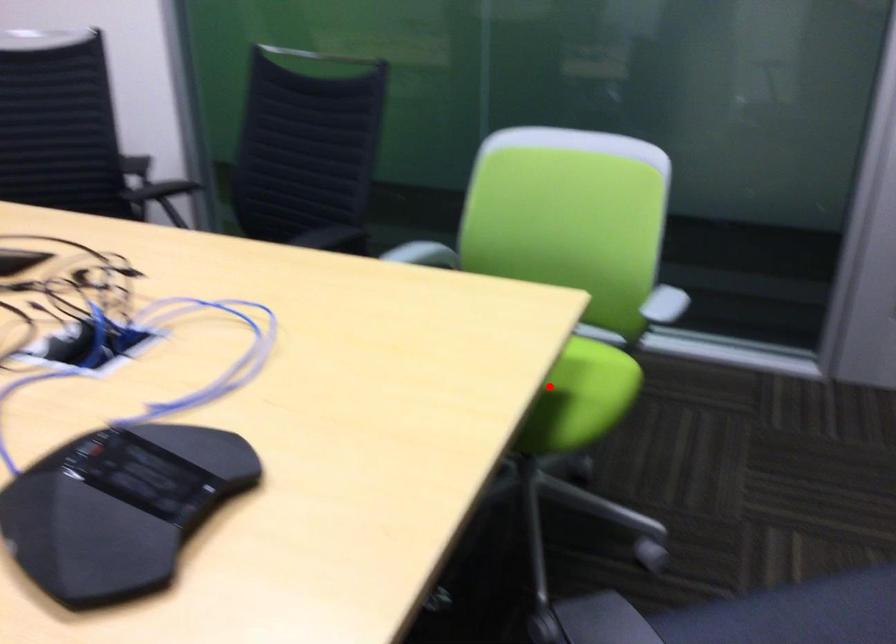
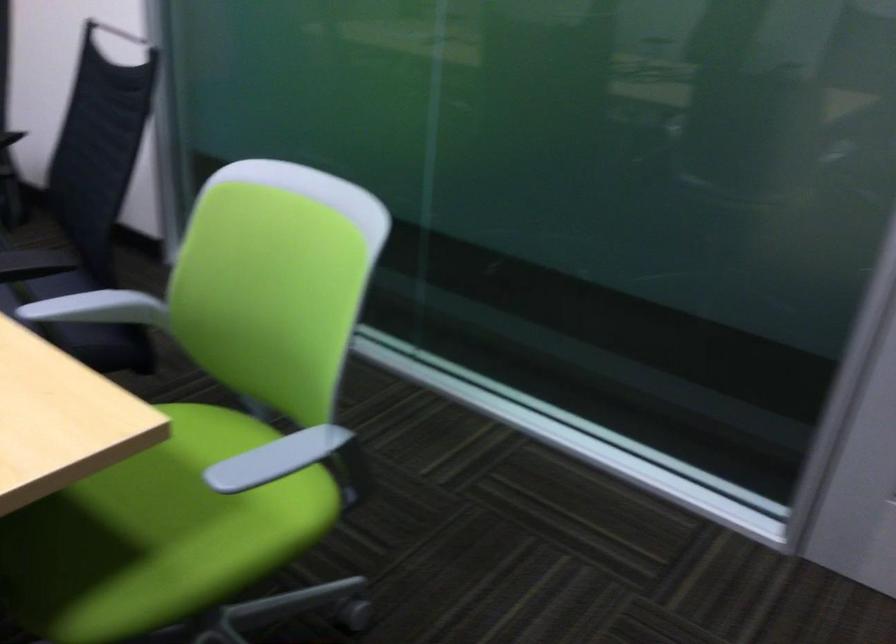
Question: I am providing you with two images of the same scene from different viewpoints. Given a red point in image1, look at the same physical point in image2. Is it:

Choices:
 (A) Closer to the viewpoint
 (B) Farther from the viewpoint

Answer: (A)